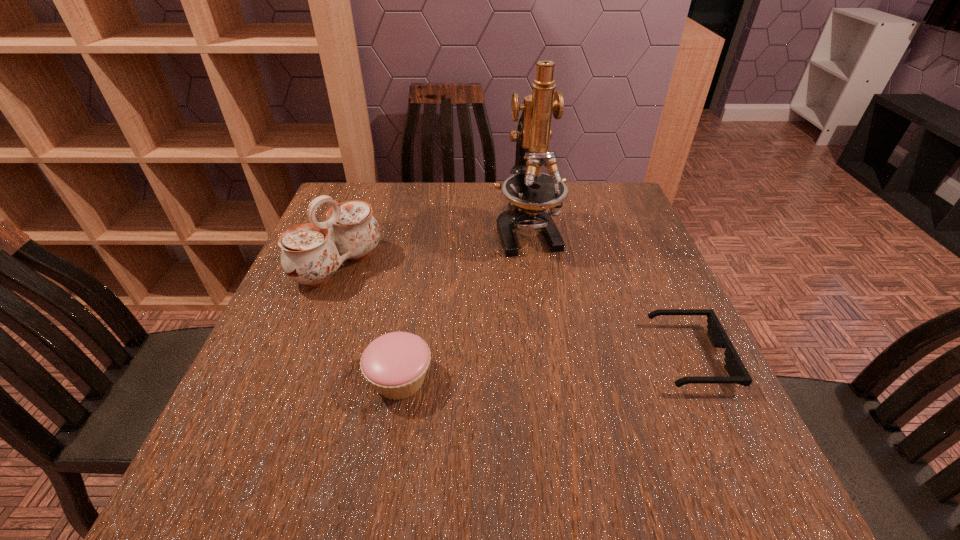
The image size is (960, 540). I want to click on free area in between the third object from left to right and the second object from left to right, so click(463, 305).

Where is `free area in between the shortest object and the microscope`? free area in between the shortest object and the microscope is located at coordinates (609, 294).

At what (x,y) coordinates should I click in order to perform the action: click on vacant point located between the microscope and the cupcake. Please return your answer as a coordinate pair (x, y). The height and width of the screenshot is (540, 960). Looking at the image, I should click on (463, 305).

You are a GUI agent. You are given a task and a screenshot of the screen. Output one action in this format:
    pyautogui.click(x=<x>, y=<y>)
    Task: Click on the unoccupied position between the second object from right to left and the chinaware
    
    Given the screenshot: What is the action you would take?
    pyautogui.click(x=432, y=248)

Where is `the closest object to the third object from left to right`? the closest object to the third object from left to right is located at coordinates (734, 366).

Select which object appears as the closest to the sunglasses. Please provide its 2D coordinates. Your answer should be formatted as a tuple, i.e. [(x, y)], where the tuple contains the x and y coordinates of a point satisfying the conditions above.

[(530, 192)]

At what (x,y) coordinates should I click in order to perform the action: click on vacant region that satisfies the following two spatial constraints: 1. on the front side of the sunglasses; 2. on the front-facing side of the third shortest object. Please return your answer as a coordinate pair (x, y). This screenshot has width=960, height=540. Looking at the image, I should click on (303, 356).

Image resolution: width=960 pixels, height=540 pixels. In order to click on vacant space that satisfies the following two spatial constraints: 1. on the back side of the cupcake; 2. on the front-facing side of the shortest object in this screenshot , I will do `click(403, 356)`.

Where is `blank space that satisfies the following two spatial constraints: 1. on the back side of the microscope; 2. on the right side of the leftmost object`? This screenshot has height=540, width=960. blank space that satisfies the following two spatial constraints: 1. on the back side of the microscope; 2. on the right side of the leftmost object is located at coordinates [351, 231].